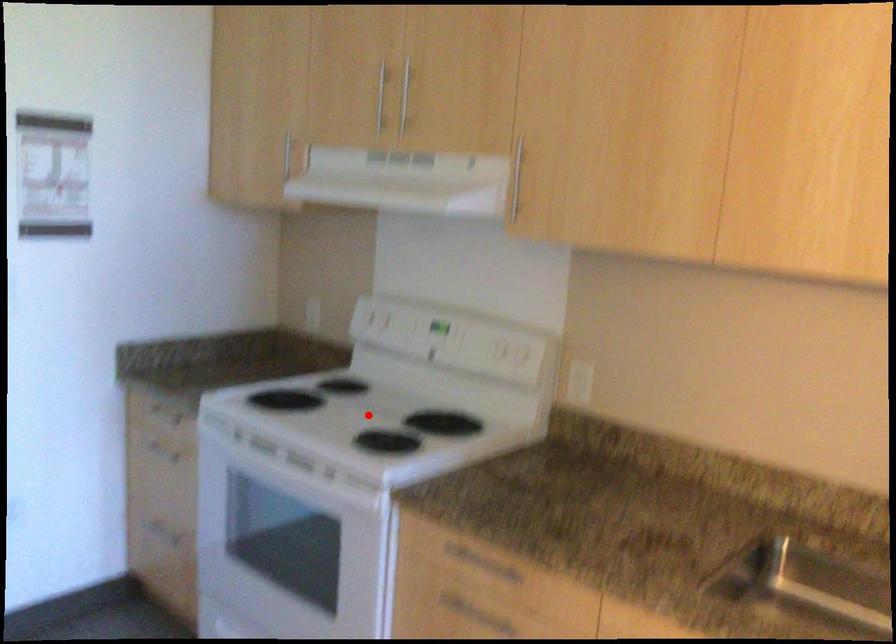
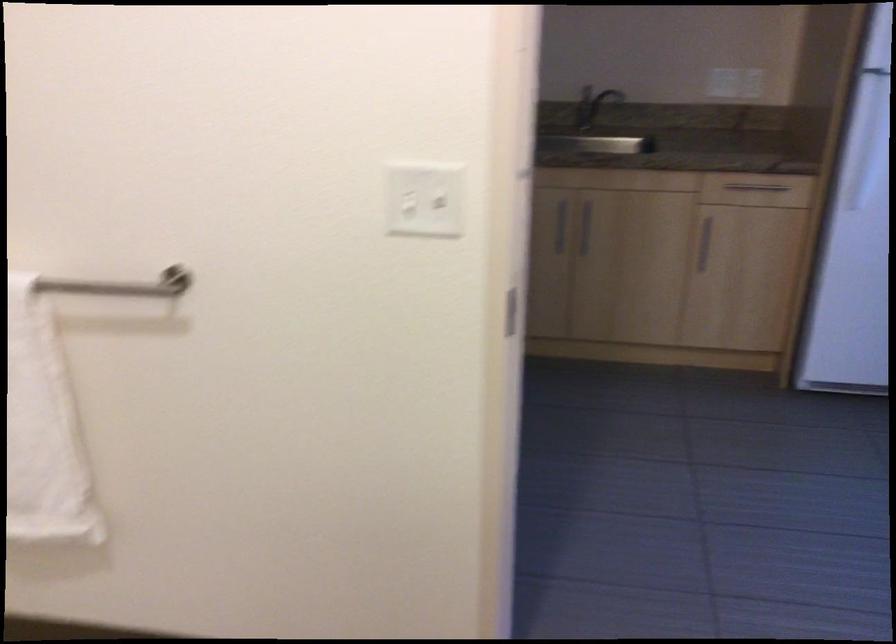
Question: I am providing you with two images of the same scene from different viewpoints. A red point is marked on the first image. At the location where the point appears in image 1, is it still visible in image 2?

Choices:
 (A) Yes
 (B) No

Answer: (B)